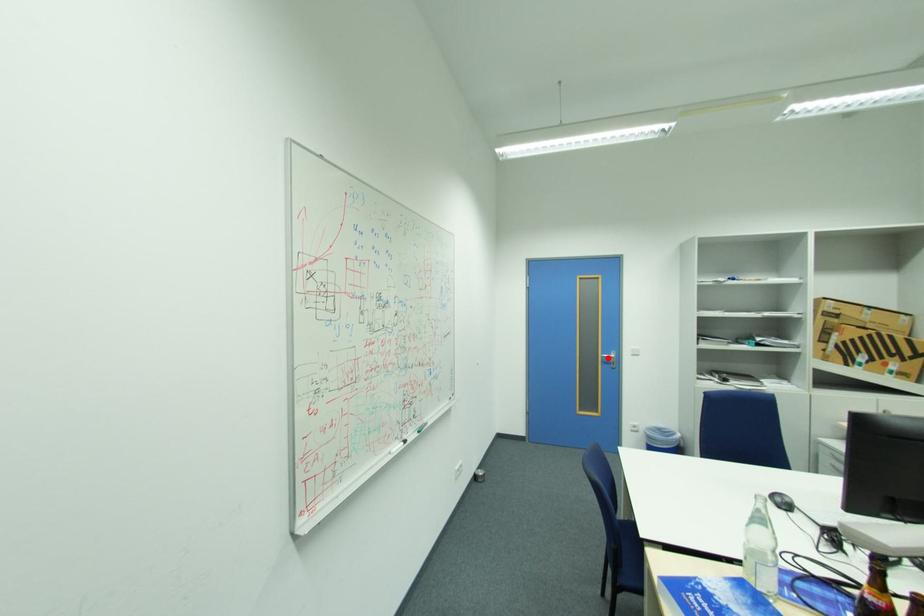
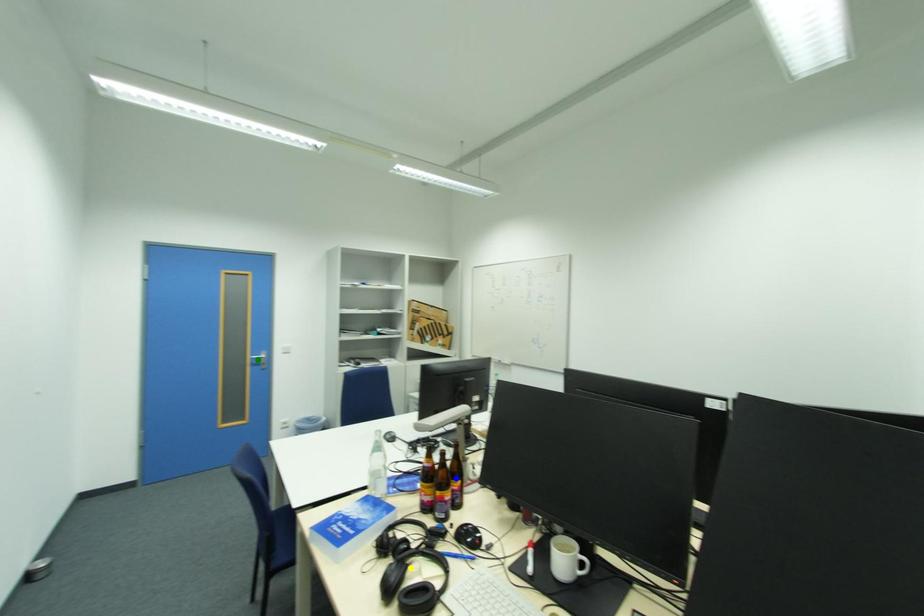
Question: I am providing you with two images of the same scene from different viewpoints. A red point is marked on the first image. You are given multiple points on the second image. Which point in image 2 is actually the same real-world point as the red point in image 1?

Choices:
 (A) green point
 (B) blue point
 (C) yellow point

Answer: (A)